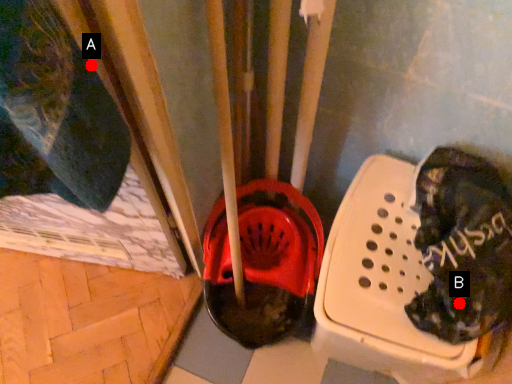
Question: Two points are circled on the image, labeled by A and B beside each circle. Which point appears closest to the camera in this image?

Choices:
 (A) A is closer
 (B) B is closer

Answer: (A)